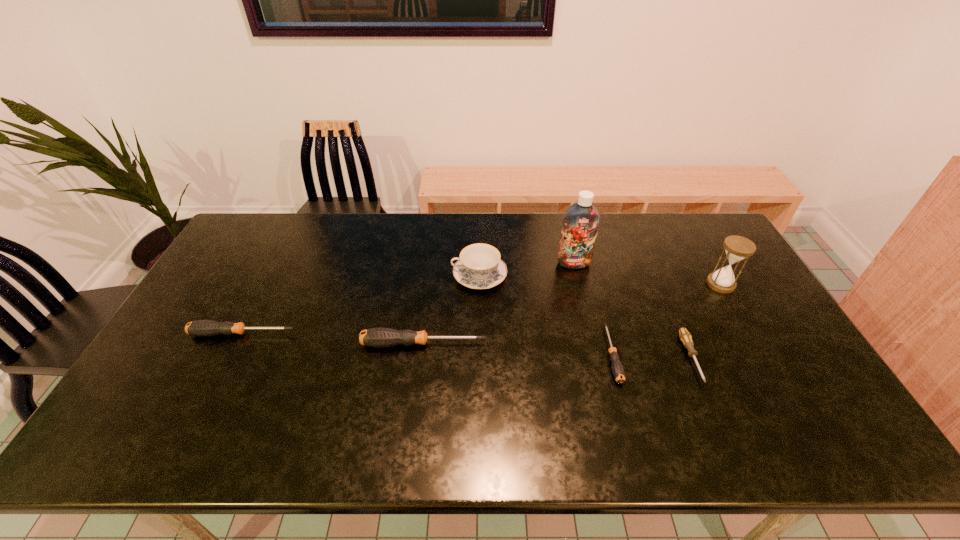
In order to click on vacant space at the far edge of the desktop in this screenshot , I will do `click(657, 246)`.

I want to click on vacant area at the near edge, so click(x=204, y=400).

You are a GUI agent. You are given a task and a screenshot of the screen. Output one action in this format:
    pyautogui.click(x=<x>, y=<y>)
    Task: Click on the vacant space at the left edge of the desktop
    
    Given the screenshot: What is the action you would take?
    click(206, 362)

Image resolution: width=960 pixels, height=540 pixels. Identify the location of vacant space at the right edge of the desktop. (768, 338).

Image resolution: width=960 pixels, height=540 pixels. I want to click on vacant area between the leftmost screwdriver and the sixth shortest object, so click(x=481, y=309).

The width and height of the screenshot is (960, 540). I want to click on unoccupied position between the chinaware and the rightmost screwdriver, so click(x=585, y=317).

Where is `unoccupied area between the tallest object and the leftmost screwdriver`? Image resolution: width=960 pixels, height=540 pixels. unoccupied area between the tallest object and the leftmost screwdriver is located at coordinates (408, 299).

Identify the location of free spot between the third screwdriver from left to right and the second tallest screwdriver. (427, 344).

You are a GUI agent. You are given a task and a screenshot of the screen. Output one action in this format:
    pyautogui.click(x=<x>, y=<y>)
    Task: Click on the vacant point located between the chinaware and the third screwdriver from left to right
    This screenshot has width=960, height=540.
    Given the screenshot: What is the action you would take?
    pyautogui.click(x=545, y=315)

The image size is (960, 540). I want to click on free point between the second screwdriver from left to right and the second object from right to left, so click(x=557, y=351).